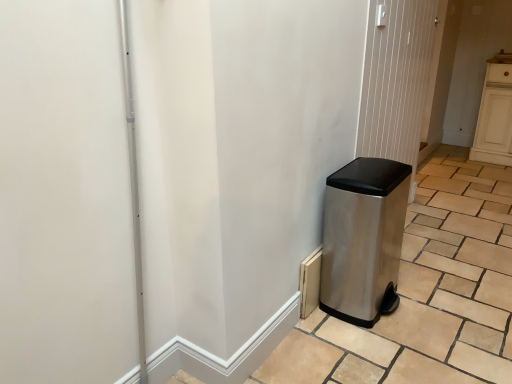
This screenshot has height=384, width=512. Find the location of `empty space that is to the right of stainless steel trash can at right`. empty space that is to the right of stainless steel trash can at right is located at coordinates (446, 230).